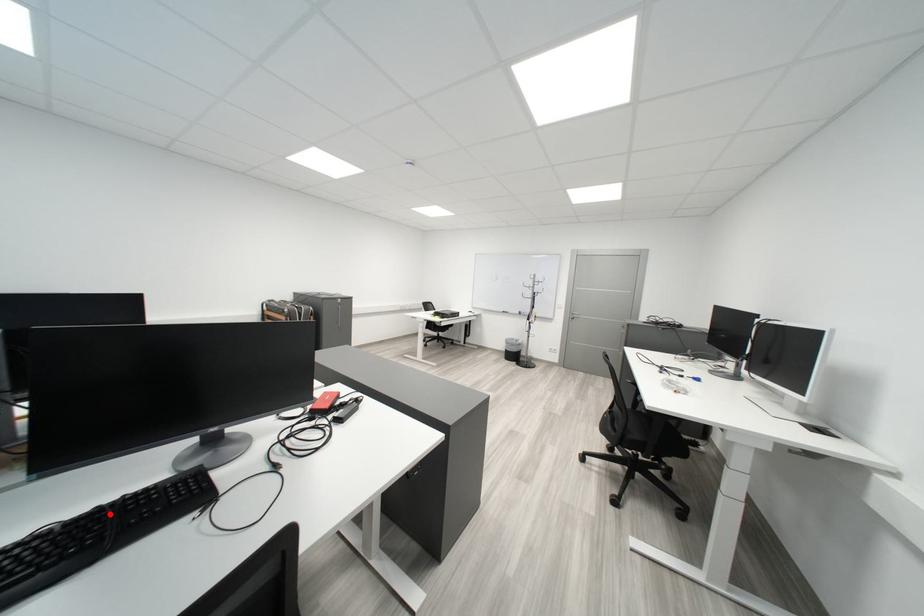
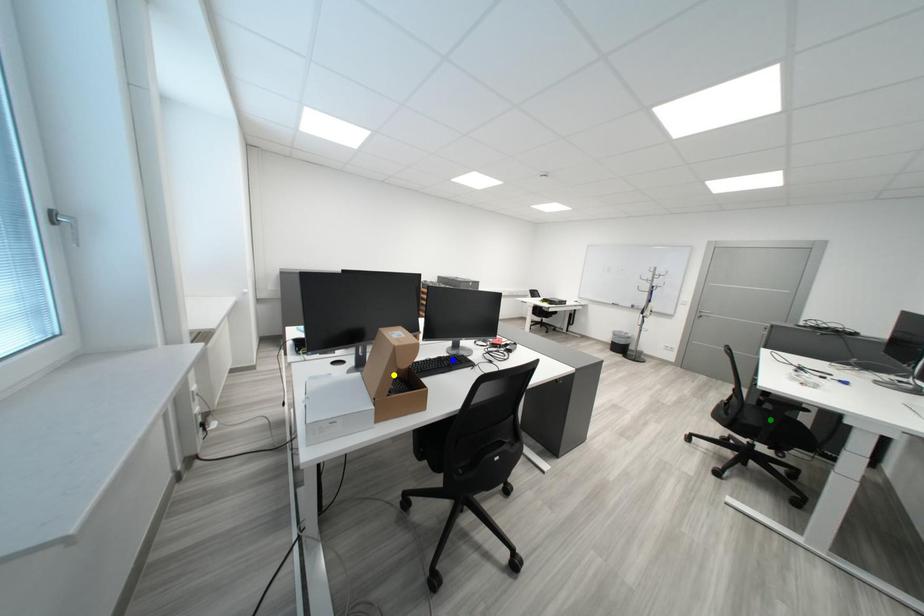
Question: I am providing you with two images of the same scene from different viewpoints. A red point is marked on the first image. You are given multiple points on the second image. Which mark in image 2 goes with the point in image 1?

Choices:
 (A) blue point
 (B) yellow point
 (C) green point

Answer: (A)